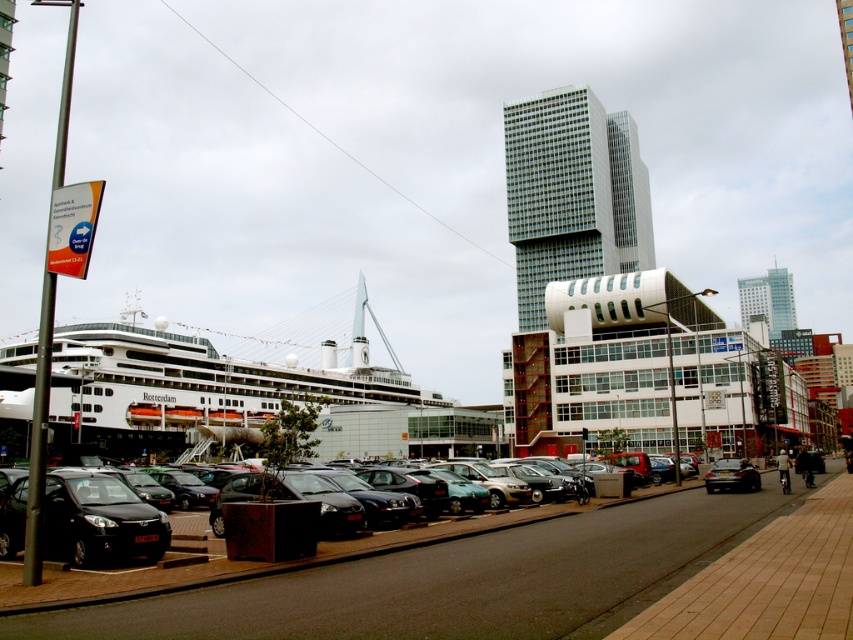
Who is positioned more to the left, white glossy cruise ship at lower left or shiny black hatchback at lower left?

Positioned to the left is white glossy cruise ship at lower left.

From the picture: Which is more to the right, white glossy cruise ship at lower left or shiny black hatchback at lower left?

A: Positioned to the right is shiny black hatchback at lower left.

Who is more distant from viewer, [161,428] or [137,547]?

Point [161,428]

This screenshot has height=640, width=853. Identify the location of white glossy cruise ship at lower left. (196, 387).

Does point (520, 525) come closer to viewer compared to point (344, 401)?

Yes, point (520, 525) is closer to viewer.

The width and height of the screenshot is (853, 640). Describe the element at coordinates (457, 580) in the screenshot. I see `shiny black cars at lower left` at that location.

Who is more forward, (700, 499) or (131, 413)?

Positioned in front is point (700, 499).

Locate an element on the screen. Image resolution: width=853 pixels, height=640 pixels. shiny black cars at lower left is located at coordinates pos(457,580).

Can you confirm if shiny black cars at lower left is shorter than shiny black hatchback at lower left?

In fact, shiny black cars at lower left may be taller than shiny black hatchback at lower left.

Which is in front, point (405, 632) or point (120, 499)?

Point (405, 632)

Between point (515, 609) and point (15, 492), which one is positioned in front?

Positioned in front is point (515, 609).

Locate an element on the screen. The height and width of the screenshot is (640, 853). shiny black cars at lower left is located at coordinates (457, 580).